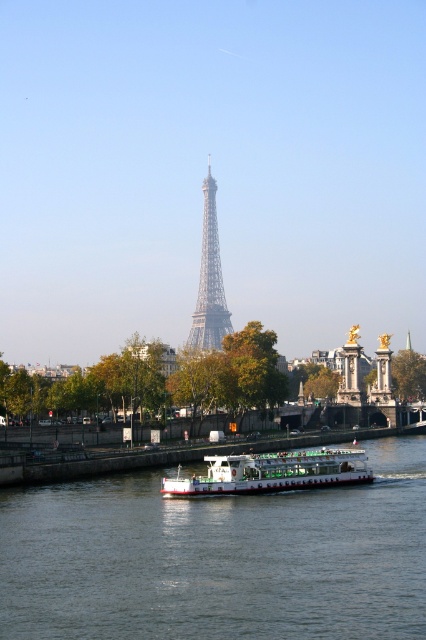
You are standing on the riverbank and want to take a photo of both the green smooth water at center and the white matte boat at center. Which object should you focus on first to ensure both are in sharp focus?

You should focus on the white matte boat at center first because it is farther away than the green smooth water at center, ensuring both will be in focus when using a camera with depth of field considerations.

You are a photographer planning to capture the entire Eiffel Tower and the boat in one frame. Given that the green smooth water at center is wider than the white matte boat at center, which object should you position closer to the edge of your camera frame to ensure both the Eiffel Tower and the boat are fully visible?

To ensure both the Eiffel Tower and the white matte boat at center are fully visible, you should position the white matte boat at center closer to the edge of your camera frame since the green smooth water at center is wider and can occupy more space in the frame without cropping the boat.